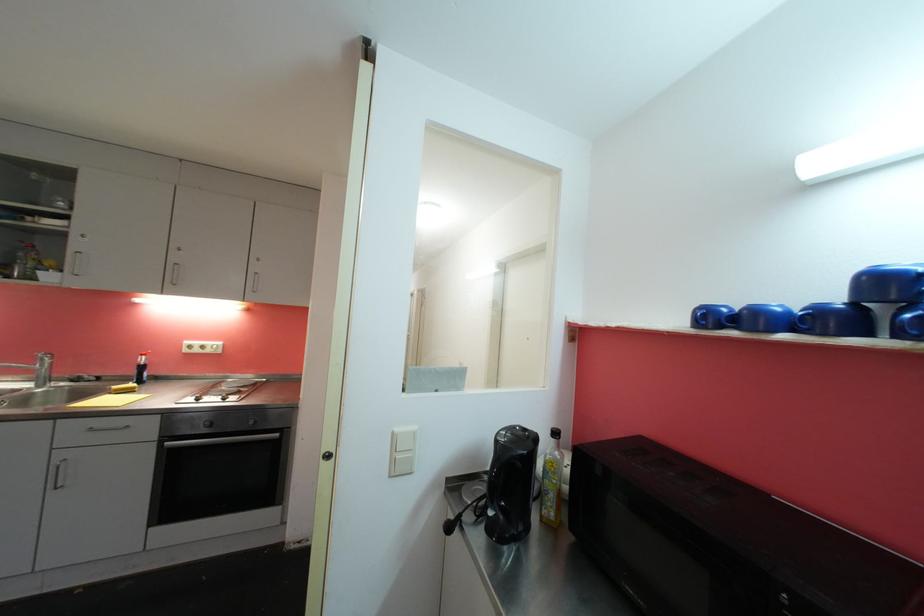
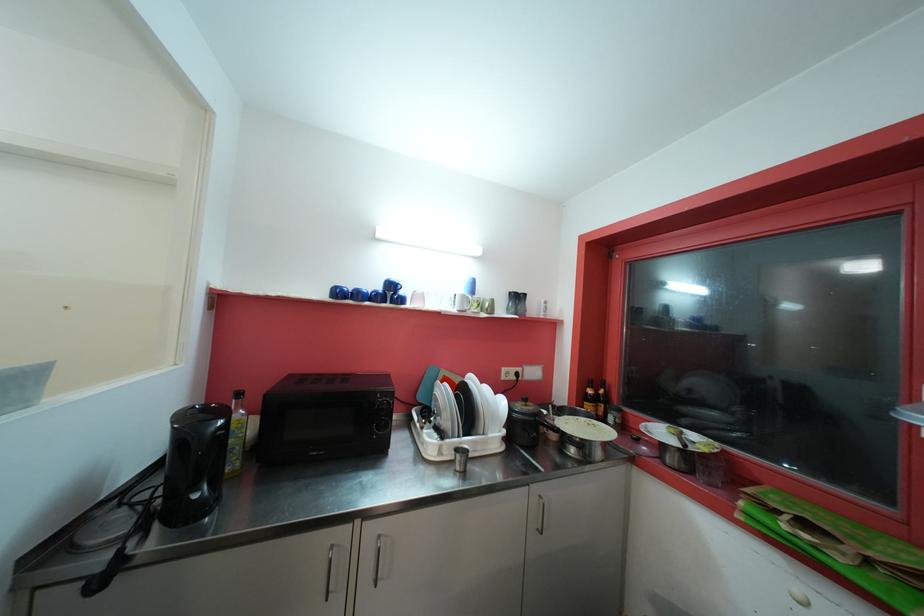
Find the pixel in the second image that matches [713,318] in the first image.

(343, 294)